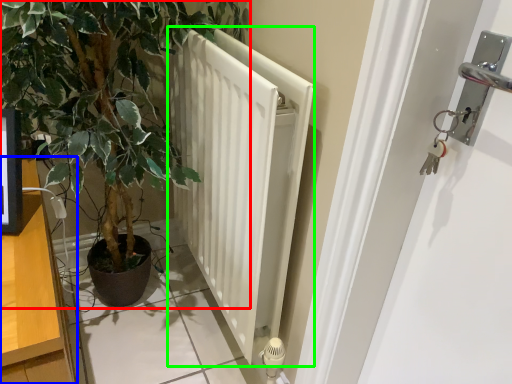
Question: Estimate the real-world distances between objects in this image. Which object is farther from houseplant (highlighted by a red box), dresser (highlighted by a blue box) or radiator (highlighted by a green box)?

Choices:
 (A) dresser
 (B) radiator

Answer: (A)